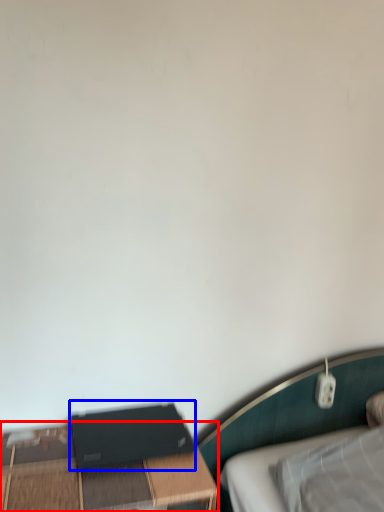
Question: Which object appears closest to the camera in this image, table (highlighted by a red box) or computer (highlighted by a blue box)?

Choices:
 (A) table
 (B) computer

Answer: (A)